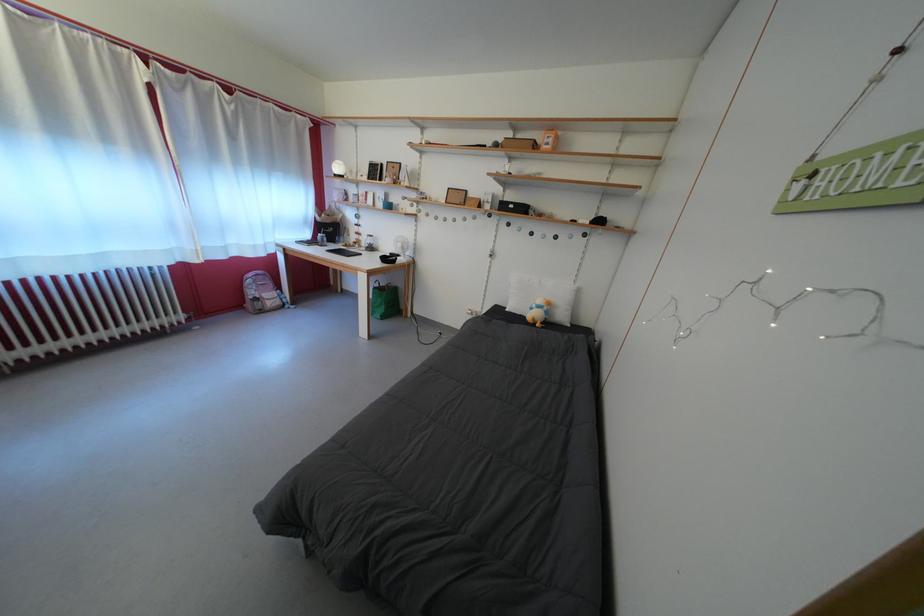
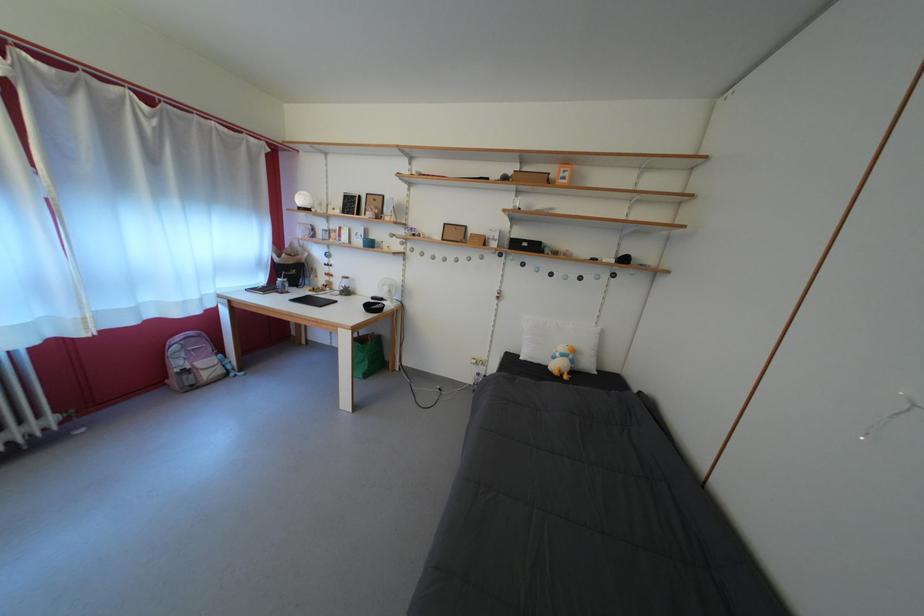
Question: The camera is either moving clockwise (left) or counter-clockwise (right) around the object. The first image is from the beginning of the video and the second image is from the end. Is the camera moving left or right when shooting the video?

Choices:
 (A) Left
 (B) Right

Answer: (A)